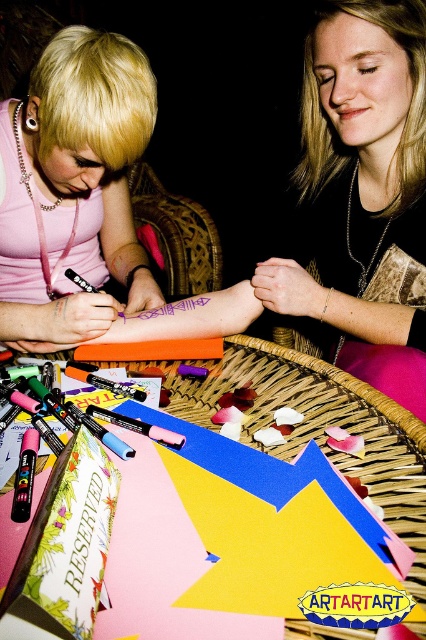
Question: Which point appears closest to the camera in this image?

Choices:
 (A) (215, 381)
 (B) (43, 128)

Answer: (A)

Question: Does blonde hair at upper left appear on the left side of matte pink shirt at upper left?

Choices:
 (A) no
 (B) yes

Answer: (A)

Question: Which point is farther to the camera?

Choices:
 (A) pink paper at center
 (B) orange matte crayon at center
 (C) matte pink shirt at upper left
 (D) blonde hair at upper left

Answer: (C)

Question: Which object is the farthest from the orange matte crayon at center?

Choices:
 (A) pink paper at center
 (B) matte pink shirt at upper left
 (C) blonde hair at upper left

Answer: (B)

Question: Can you confirm if matte pink shirt at upper left is thinner than pink paper at center?

Choices:
 (A) yes
 (B) no

Answer: (A)

Question: Is matte pink shirt at upper left bigger than orange matte crayon at center?

Choices:
 (A) yes
 (B) no

Answer: (A)